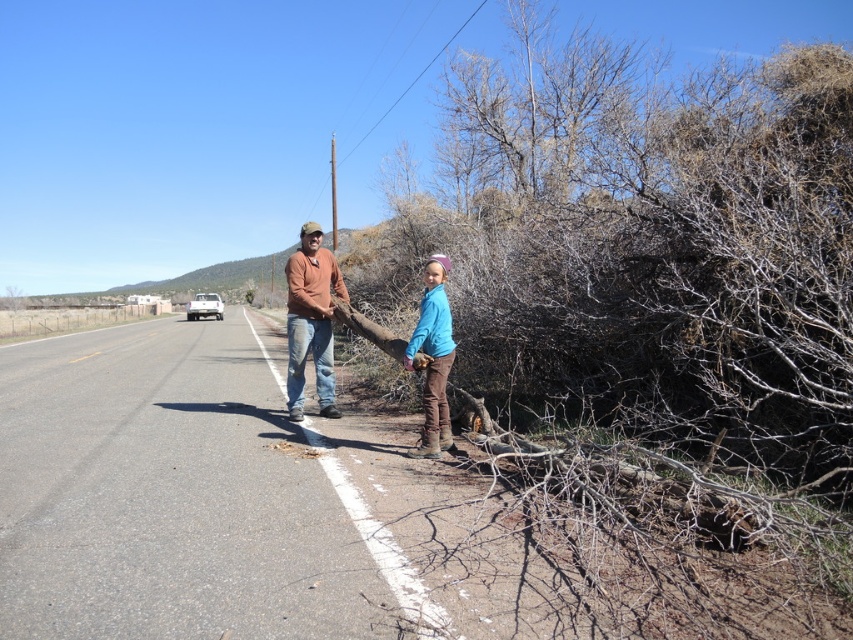
You are a pedestrian trying to cross the road safely. You see the asphalt road at center and the matte orange shirt at center. Which object is lower to the ground?

The asphalt road at center is lower to the ground compared to the matte orange shirt at center since the asphalt road at center has a lesser height than the matte orange shirt at center.

You are a pedestrian trying to cross the road safely. You see the brown dry wood at right and the asphalt road at center. Which object should you avoid stepping on to stay safe?

You should avoid stepping on the asphalt road at center because it is the actual road surface where vehicles might pass, while the brown dry wood at right is on the roadside, a safer area for pedestrians.